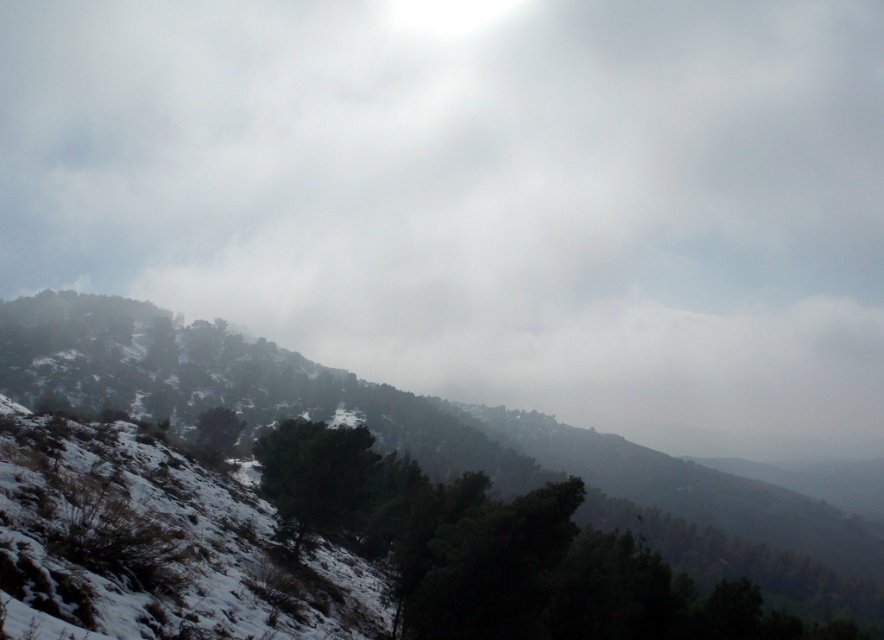
You are a hiker trying to navigate through the mountain slope. You have two markers, one at point (570, 122) and another at point (59, 321). Which marker is closer to your current position?

Point (570, 122) is further to the viewer than point (59, 321), so the marker at point (59, 321) is closer to your current position.

You are planning a hiking route and need to decide whether to go around the snowy forested hillside at upper left or pass under the white fluffy cloud at upper center. Based on their positions, which path would be more sheltered from the wind?

The white fluffy cloud at upper center is positioned over the snowy forested hillside at upper left. Therefore, the path around the snowy forested hillside at upper left would be more sheltered from the wind as it is located beneath the cloud, which might block some wind.